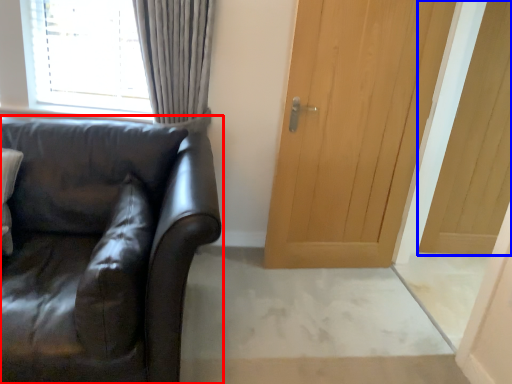
Question: Which of the following is the closest to the observer, studio couch (highlighted by a red box) or door (highlighted by a blue box)?

Choices:
 (A) studio couch
 (B) door

Answer: (A)